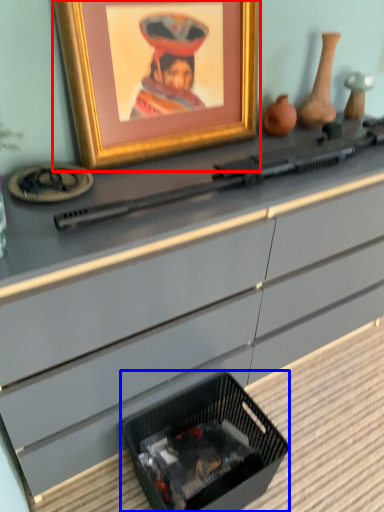
Question: Among these objects, which one is farthest to the camera, picture frame (highlighted by a red box) or basket (highlighted by a blue box)?

Choices:
 (A) picture frame
 (B) basket

Answer: (B)